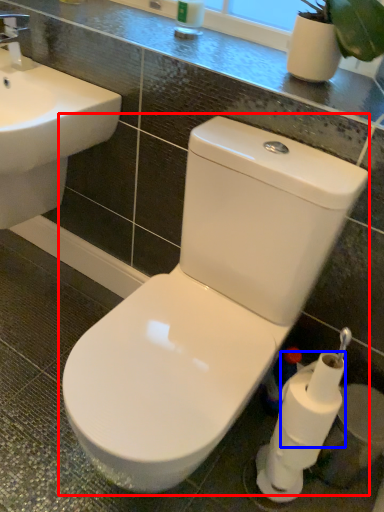
Question: Which object is further to the camera taking this photo, toilet (highlighted by a red box) or toilet paper (highlighted by a blue box)?

Choices:
 (A) toilet
 (B) toilet paper

Answer: (B)